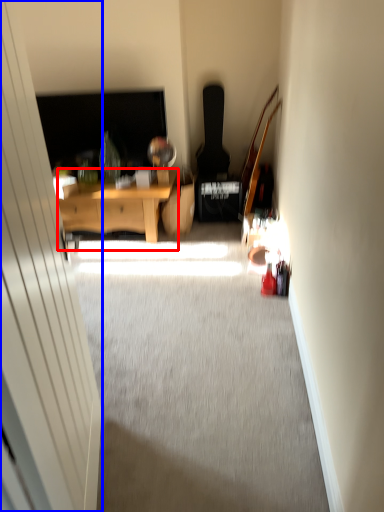
Question: Which of the following is the farthest to the observer, desk (highlighted by a red box) or glass door (highlighted by a blue box)?

Choices:
 (A) desk
 (B) glass door

Answer: (A)